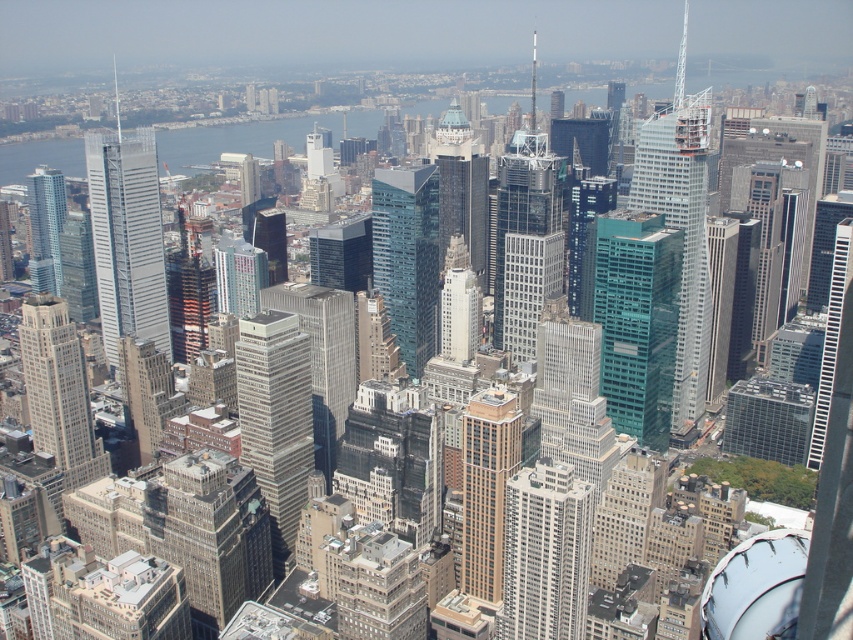
Who is taller, glassy steel skyscraper at center or shiny glass skyscraper at left?

glassy steel skyscraper at center

Is glassy steel skyscraper at center to the left of shiny glass skyscraper at left from the viewer's perspective?

Incorrect, glassy steel skyscraper at center is not on the left side of shiny glass skyscraper at left.

Find the location of a particular element. This screenshot has width=853, height=640. glassy steel skyscraper at center is located at coordinates pyautogui.click(x=525, y=241).

Does glassy silver skyscraper at left have a lesser height compared to transparent glass skyscraper at center?

In fact, glassy silver skyscraper at left may be taller than transparent glass skyscraper at center.

Which is behind, point (148, 195) or point (422, 221)?

The point (148, 195) is more distant.

I want to click on glassy silver skyscraper at left, so click(126, 236).

Which is more to the left, green glass skyscraper at center-right or transparent glass skyscraper at center?

From the viewer's perspective, transparent glass skyscraper at center appears more on the left side.

Does green glass skyscraper at center-right appear over transparent glass skyscraper at center?

Yes.

Is point (666, 144) positioned after point (418, 212)?

Yes, point (666, 144) is behind point (418, 212).

Identify the location of green glass skyscraper at center-right. (683, 230).